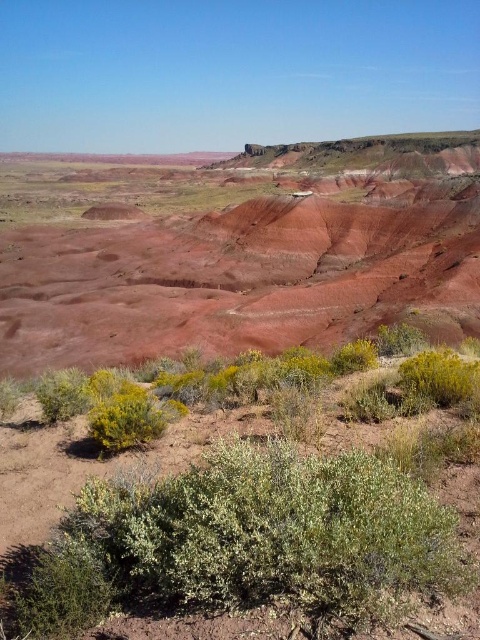
Can you confirm if rustic clay hillside at center is wider than green leafy bush at lower right?

Indeed, rustic clay hillside at center has a greater width compared to green leafy bush at lower right.

Describe the element at coordinates (239, 250) in the screenshot. Image resolution: width=480 pixels, height=640 pixels. I see `rustic clay hillside at center` at that location.

At what (x,y) coordinates should I click in order to perform the action: click on rustic clay hillside at center. Please return your answer as a coordinate pair (x, y). Looking at the image, I should click on (239, 250).

Image resolution: width=480 pixels, height=640 pixels. In order to click on rustic clay hillside at center in this screenshot , I will do `click(239, 250)`.